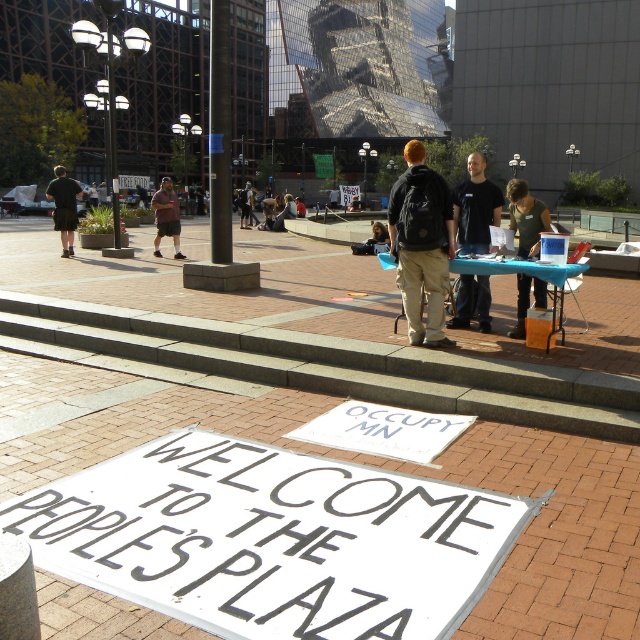
Who is shorter, matte black backpack at center or green fabric shirt at center?

matte black backpack at center is shorter.

Is matte black backpack at center positioned before green fabric shirt at center?

Yes, matte black backpack at center is closer to the viewer.

Find the location of a particular element. matte black backpack at center is located at coordinates (420, 243).

Between point (413, 234) and point (168, 189), which one is positioned behind?

Positioned behind is point (168, 189).

Can you confirm if matte black backpack at center is positioned above brown cotton shorts at center?

No, matte black backpack at center is not above brown cotton shorts at center.

Which is behind, point (417, 145) or point (173, 234)?

The point (173, 234) is behind.

The image size is (640, 640). In order to click on matte black backpack at center in this screenshot , I will do `click(420, 243)`.

Does white paper sign at center have a greater height compared to dark brown shorts at left?

No, white paper sign at center is not taller than dark brown shorts at left.

Image resolution: width=640 pixels, height=640 pixels. Identify the location of white paper sign at center. (272, 540).